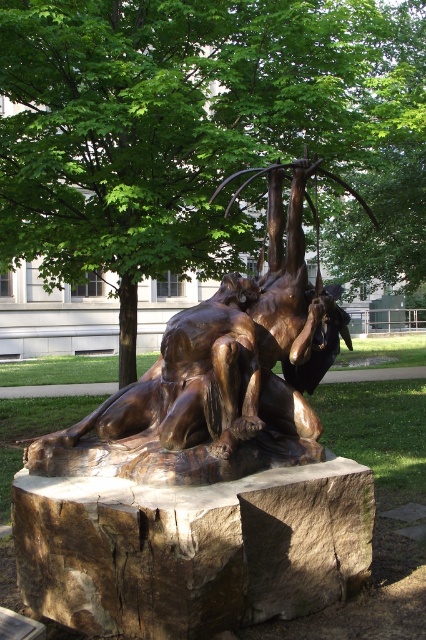
Who is positioned more to the right, brown rough stone at center or bronze sculpture at center?

bronze sculpture at center

From the picture: Which of these two, brown rough stone at center or bronze sculpture at center, stands taller?

Standing taller between the two is bronze sculpture at center.

Does point (232, 552) lie in front of point (307, 332)?

Yes, it is in front of point (307, 332).

What are the coordinates of `brown rough stone at center` in the screenshot? It's located at (192, 548).

Can you confirm if green leafy tree at upper center is positioned to the right of bronze sculpture at center?

Correct, you'll find green leafy tree at upper center to the right of bronze sculpture at center.

Which is behind, point (155, 262) or point (256, 435)?

Positioned behind is point (155, 262).

What are the coordinates of `green leafy tree at upper center` in the screenshot? It's located at (198, 129).

Is bronze sculpture at center taller than bronze statue at center?

Indeed, bronze sculpture at center has a greater height compared to bronze statue at center.

Between point (143, 477) and point (178, 388), which one is positioned in front?

Positioned in front is point (143, 477).

I want to click on bronze sculpture at center, so click(221, 376).